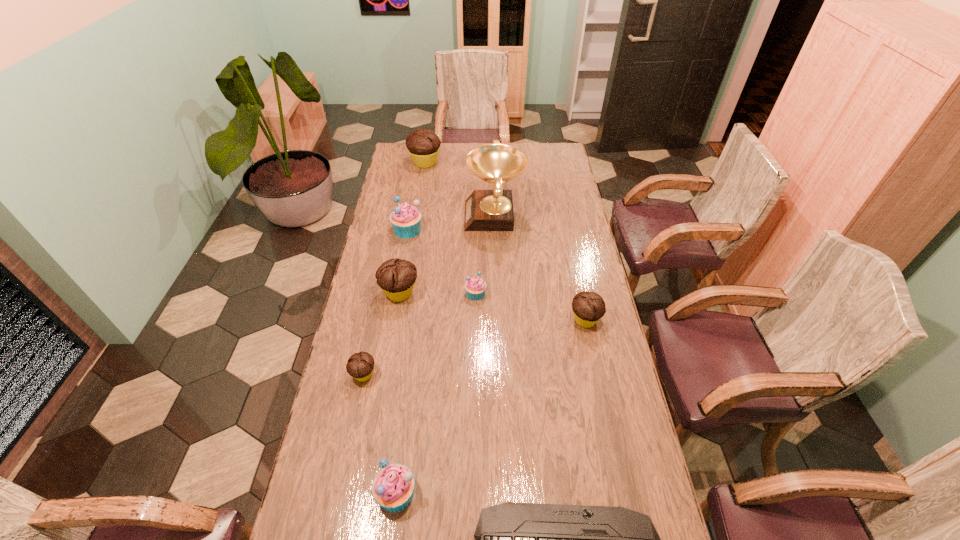
Where is `the second muffin from right to left`? The height and width of the screenshot is (540, 960). the second muffin from right to left is located at coordinates (475, 288).

Locate an element on the screen. The image size is (960, 540). the second farthest blue muffin is located at coordinates (475, 288).

The height and width of the screenshot is (540, 960). I want to click on the nearest chocolate muffin, so click(x=360, y=365).

You are a GUI agent. You are given a task and a screenshot of the screen. Output one action in this format:
    pyautogui.click(x=<x>, y=<y>)
    Task: Click on the third nearest object
    The height and width of the screenshot is (540, 960).
    Given the screenshot: What is the action you would take?
    pyautogui.click(x=360, y=365)

Locate an element on the screen. free region located 0.130m on the front-facing side of the award is located at coordinates (436, 217).

At what (x,y) coordinates should I click in order to perform the action: click on vacant space located on the front-facing side of the award. Please return your answer as a coordinate pair (x, y). This screenshot has height=540, width=960. Looking at the image, I should click on (411, 217).

Where is `free space located on the front-facing side of the award`? The width and height of the screenshot is (960, 540). free space located on the front-facing side of the award is located at coordinates (418, 217).

At what (x,y) coordinates should I click in order to perform the action: click on free space located 0.120m on the front of the biggest chocolate muffin. Please return your answer as a coordinate pair (x, y). Looking at the image, I should click on (421, 186).

At what (x,y) coordinates should I click in order to perform the action: click on free location located on the right of the farthest blue muffin. Please return your answer as a coordinate pair (x, y). The image size is (960, 540). Looking at the image, I should click on (453, 230).

The height and width of the screenshot is (540, 960). Identify the location of vacant space located 0.190m on the right of the second biggest chocolate muffin. (470, 293).